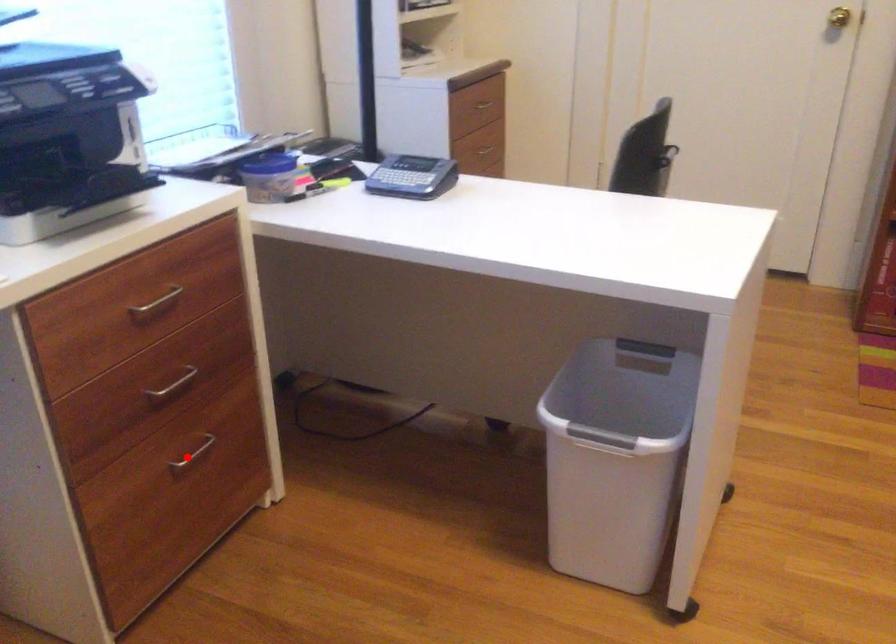
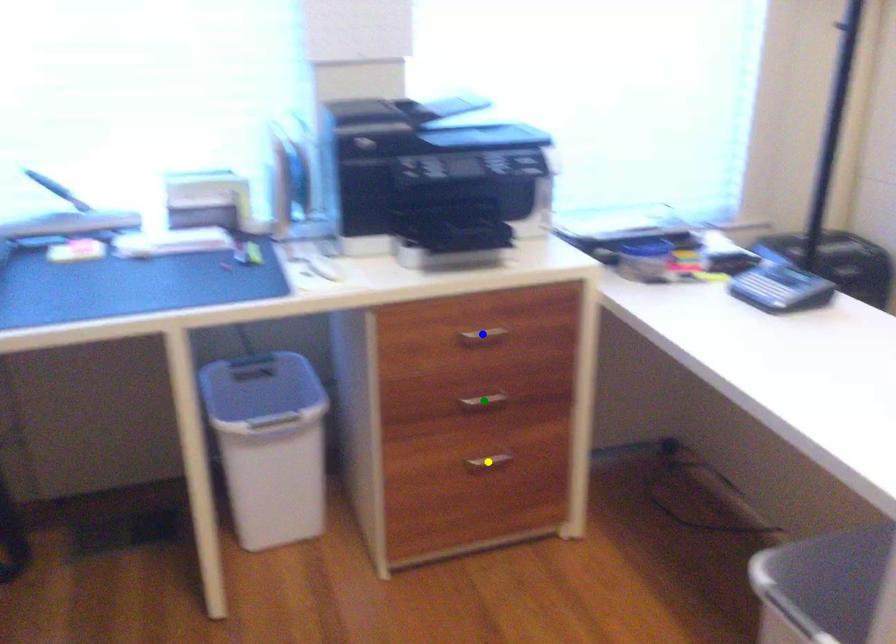
Question: I am providing you with two images of the same scene from different viewpoints. A red point is marked on the first image. You are given multiple points on the second image. In image 2, which mark is for the same physical point as the one in image 1?

Choices:
 (A) green point
 (B) yellow point
 (C) blue point

Answer: (B)